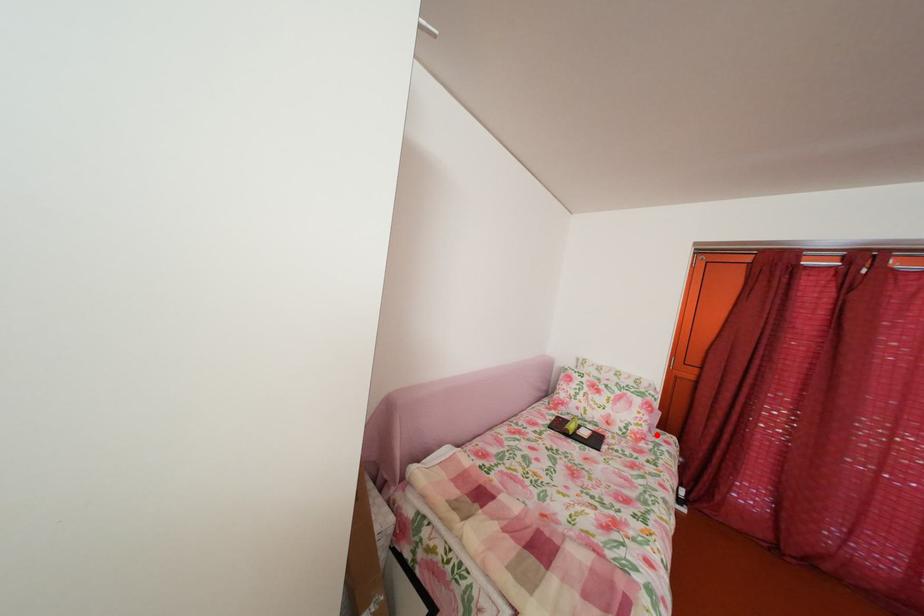
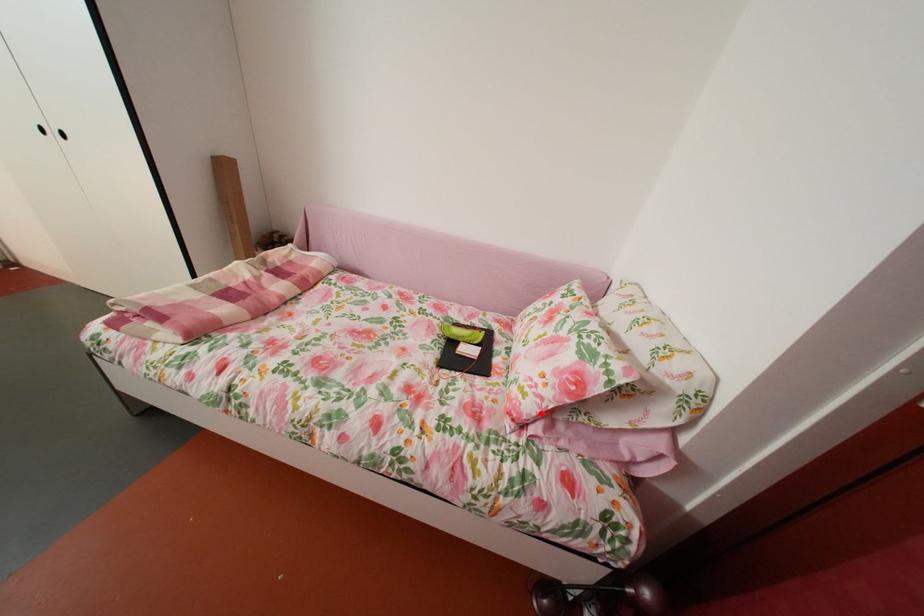
I am providing you with two images of the same scene from different viewpoints. A red point is marked on the first image and another point is marked on the second image. Is the marked point in image1 the same physical position as the marked point in image2?

Yes